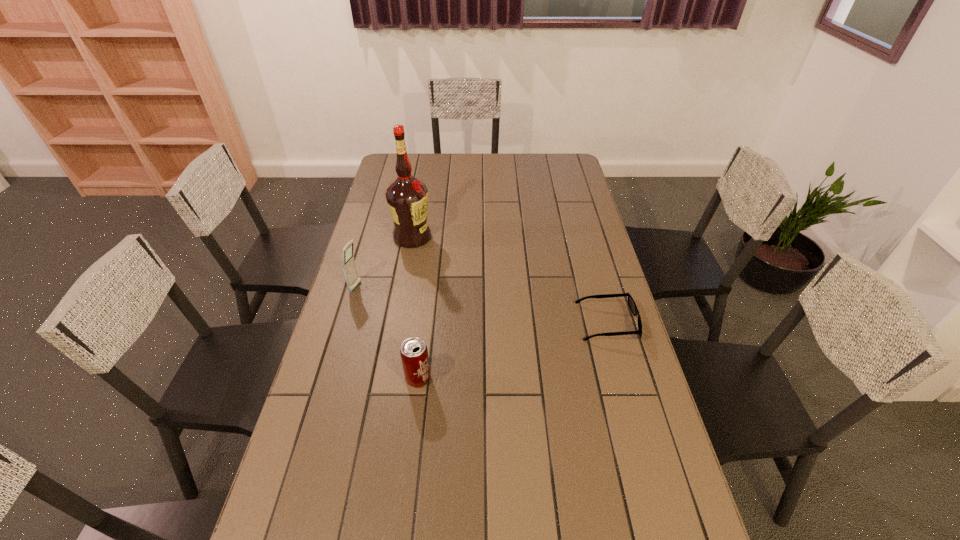
Where is `the third tallest object`? Image resolution: width=960 pixels, height=540 pixels. the third tallest object is located at coordinates (414, 354).

Locate an element on the screen. beer can is located at coordinates (414, 354).

At what (x,y) coordinates should I click in order to perform the action: click on the rightmost object. Please return your answer as a coordinate pair (x, y). Looking at the image, I should click on (631, 302).

Find the location of a particular element. This screenshot has height=540, width=960. sunglasses is located at coordinates (631, 302).

Find the location of a particular element. The image size is (960, 540). the second tallest object is located at coordinates (349, 267).

Identify the location of the leftmost object. pos(349,267).

Find the location of a particular element. This screenshot has height=540, width=960. the farthest object is located at coordinates (407, 197).

Locate an element on the screen. This screenshot has height=540, width=960. the tallest object is located at coordinates (407, 197).

The width and height of the screenshot is (960, 540). Find the location of `vacant space located on the right of the beer can`. vacant space located on the right of the beer can is located at coordinates (549, 379).

Find the location of a particular element. Image resolution: width=960 pixels, height=540 pixels. free space located on the front-facing side of the cellular telephone is located at coordinates (379, 294).